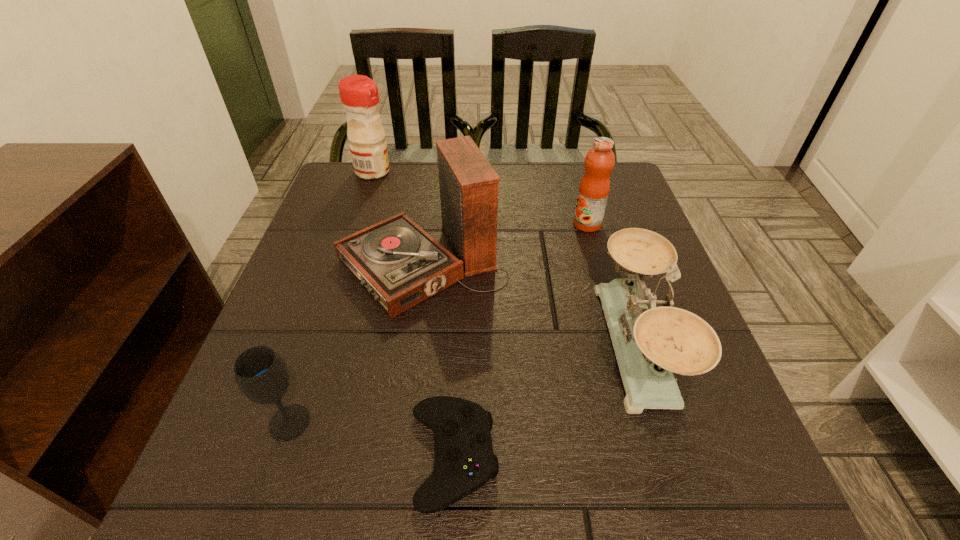
Identify the location of vacant space located on the front label of the fruit juice. This screenshot has height=540, width=960. (477, 224).

Locate an element on the screen. free region located on the front-facing side of the scale is located at coordinates (525, 345).

Where is `free region located 0.210m on the front-facing side of the scale`? The width and height of the screenshot is (960, 540). free region located 0.210m on the front-facing side of the scale is located at coordinates (487, 345).

Where is `free point located 0.160m on the front-facing side of the scale`? The image size is (960, 540). free point located 0.160m on the front-facing side of the scale is located at coordinates (515, 345).

This screenshot has height=540, width=960. In order to click on free space located on the front of the second shortest object in this screenshot , I will do (x=256, y=521).

At what (x,y) coordinates should I click in order to perform the action: click on blank space located 0.180m on the left of the control. Please return your answer as a coordinate pair (x, y). Image resolution: width=960 pixels, height=540 pixels. Looking at the image, I should click on (287, 456).

I want to click on object that is at the far edge, so click(359, 94).

The width and height of the screenshot is (960, 540). Identify the location of object present at the near edge. 465,461.

Find the location of a particular element. condiment positioned at the left edge is located at coordinates (359, 94).

Find the location of a particular element. The width and height of the screenshot is (960, 540). phonograph record located at the left edge is located at coordinates (401, 265).